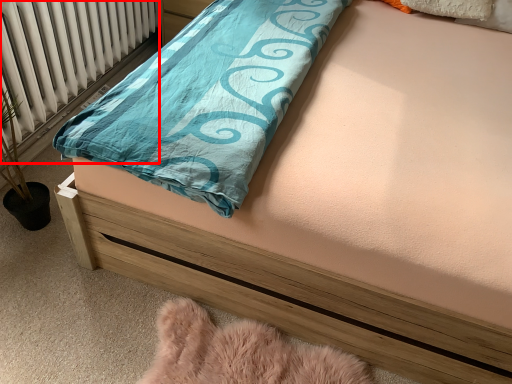
Question: Observing the image, what is the correct spatial positioning of radiator (annotated by the red box) in reference to material?

Choices:
 (A) left
 (B) right

Answer: (A)